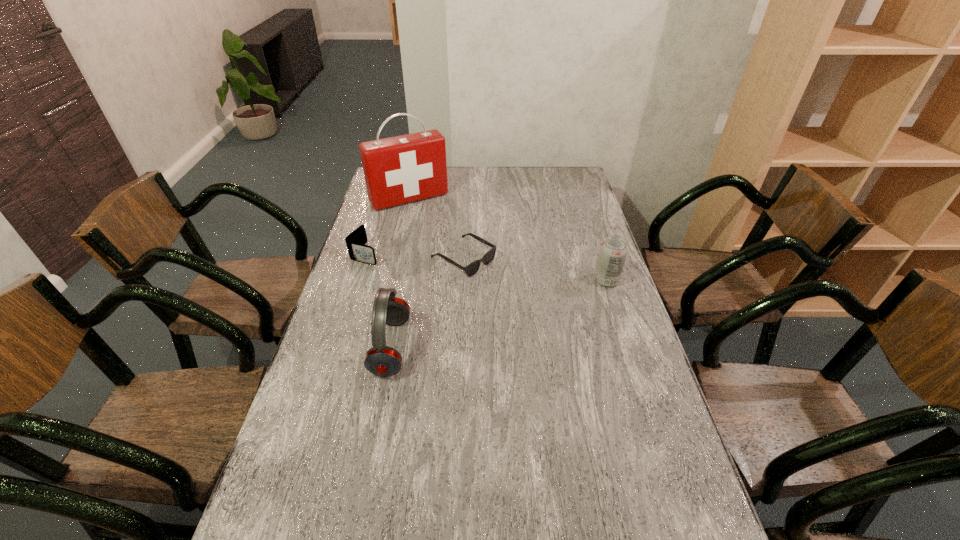
This screenshot has width=960, height=540. Identify the location of vacant space at the far right corner of the desktop. (577, 176).

This screenshot has width=960, height=540. Find the location of `free space between the sunglasses and the rightmost object`. free space between the sunglasses and the rightmost object is located at coordinates (535, 269).

Locate an element on the screen. The height and width of the screenshot is (540, 960). free space between the rightmost object and the shortest object is located at coordinates (535, 269).

Where is `vacant area that lies between the fourth tallest object and the rightmost object`? The height and width of the screenshot is (540, 960). vacant area that lies between the fourth tallest object and the rightmost object is located at coordinates (486, 267).

Where is `free space between the second shortest object and the shortest object`? free space between the second shortest object and the shortest object is located at coordinates (415, 256).

Where is `free space between the wallet and the tallest object`? The width and height of the screenshot is (960, 540). free space between the wallet and the tallest object is located at coordinates (388, 226).

Find the location of a particular element. The width and height of the screenshot is (960, 540). empty space between the fourth tallest object and the farthest object is located at coordinates (388, 226).

Identify the location of vacant region between the tallest object and the fourth tallest object. This screenshot has width=960, height=540. (388, 226).

Find the location of a particular element. The height and width of the screenshot is (540, 960). vacant area that lies between the fourth shortest object and the third tallest object is located at coordinates (499, 314).

The image size is (960, 540). Find the location of `unoccupied position between the first-aid kit and the nearest object`. unoccupied position between the first-aid kit and the nearest object is located at coordinates (400, 273).